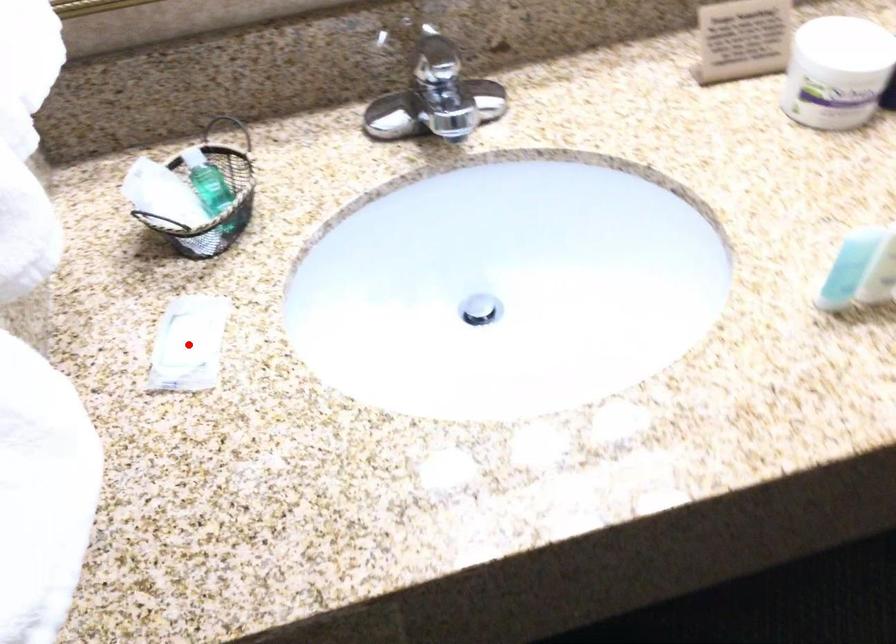
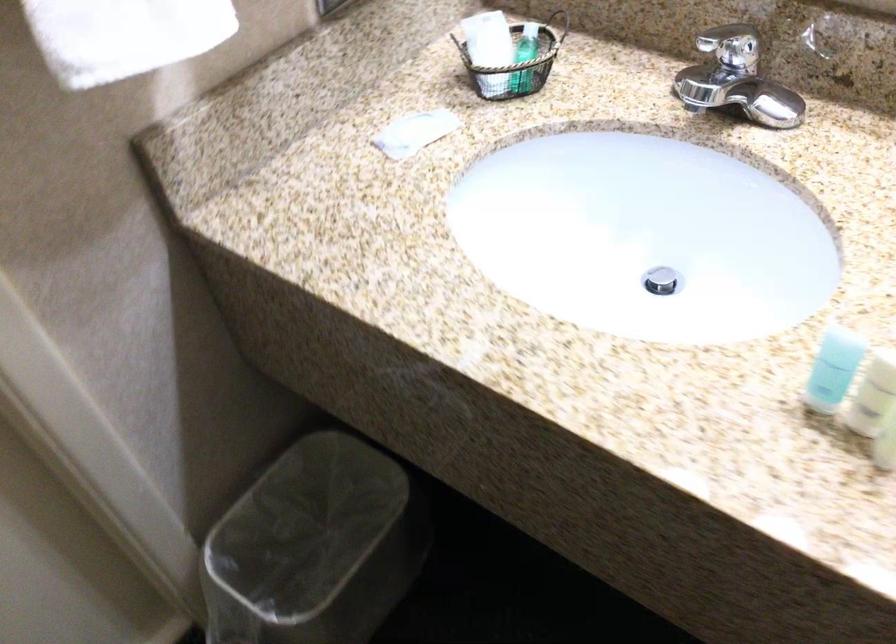
Locate, in the second image, the point that corresponds to the highlighted location in the first image.

(414, 131)